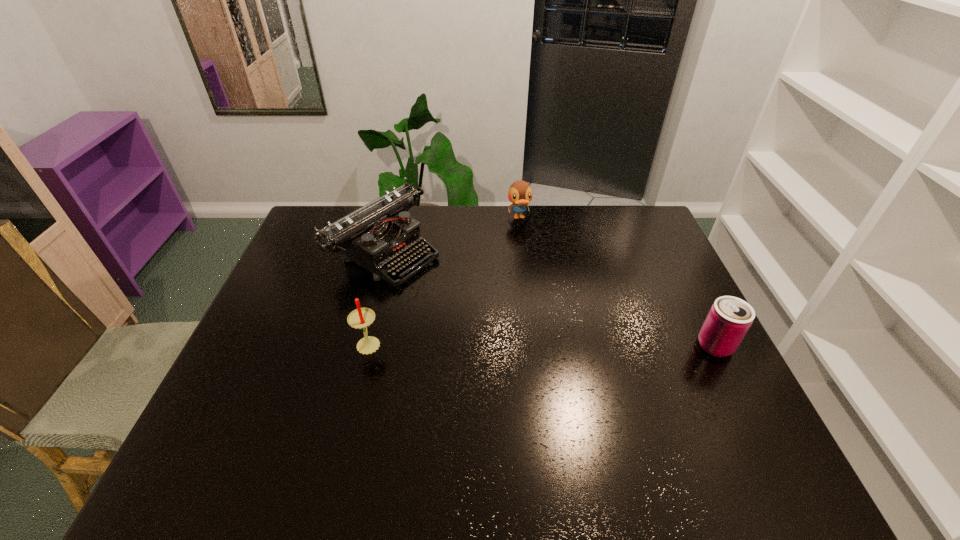
At what (x,y) coordinates should I click in order to perform the action: click on free space on the desktop that is between the candle and the can and is positioned on the front-facing side of the third object from left to right. Please return your answer as a coordinate pair (x, y). This screenshot has width=960, height=540. Looking at the image, I should click on click(558, 345).

Find the location of a particular element. The width and height of the screenshot is (960, 540). free space on the desktop that is between the candle and the rightmost object and is positioned on the keyboard of the typewriter is located at coordinates (555, 345).